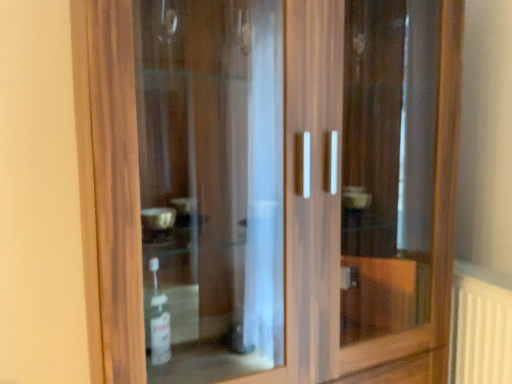
Where is `white plastic radiator at right`? white plastic radiator at right is located at coordinates (480, 327).

The height and width of the screenshot is (384, 512). What do you see at coordinates (480, 327) in the screenshot?
I see `white plastic radiator at right` at bounding box center [480, 327].

In order to face white plastic radiator at right, should I rotate leftwards or rightwards?

To face it directly, rotate right by 27.774 degrees.

Where is `white plastic radiator at right`? Image resolution: width=512 pixels, height=384 pixels. white plastic radiator at right is located at coordinates (480, 327).